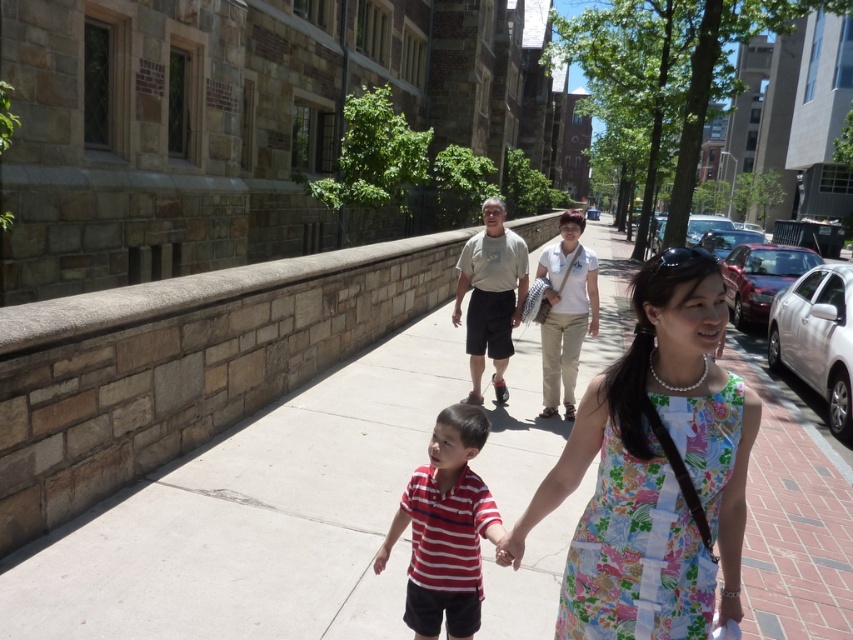
You are standing on the sidewalk and see the point marked at coordinates (x=654, y=468). Based on the scene description, which object is this point located on?

The point at (x=654, y=468) is located on the floral fabric dress at center.

Looking at this image, you are standing at the point with coordinates point (457, 636) and want to walk towards the point (737, 440). Given that the path between them is clear, will you be moving towards or away from the large stone building on the left?

Since point (737, 440) is closer to the viewer than point (457, 636), moving from point (457, 636) towards point (737, 440) means you are moving closer to the large stone building on the left.